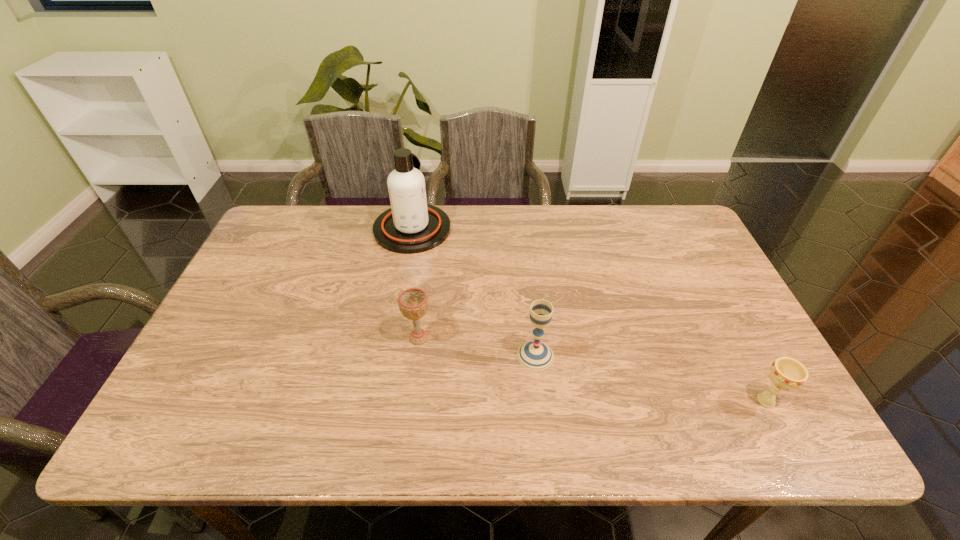
This screenshot has height=540, width=960. Identify the location of the third closest object to the farthest object. (786, 373).

Where is `object that stands as the closest to the third object from left to right`? object that stands as the closest to the third object from left to right is located at coordinates (413, 302).

Select which chalice appears as the closest to the cleansing agent. Please provide its 2D coordinates. Your answer should be formatted as a tuple, i.e. [(x, y)], where the tuple contains the x and y coordinates of a point satisfying the conditions above.

[(413, 302)]

Where is `chalice that stands as the second closest to the cleansing agent`? chalice that stands as the second closest to the cleansing agent is located at coordinates (535, 355).

Where is `vacant space that satisfies the following two spatial constraints: 1. on the front side of the second chalice from right to left; 2. on the right side of the leftmost chalice`? vacant space that satisfies the following two spatial constraints: 1. on the front side of the second chalice from right to left; 2. on the right side of the leftmost chalice is located at coordinates (417, 355).